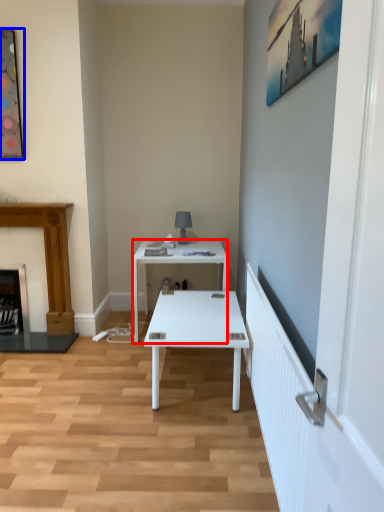
Question: Which of the following is the farthest to the observer, desk (highlighted by a red box) or picture frame (highlighted by a blue box)?

Choices:
 (A) desk
 (B) picture frame

Answer: (A)